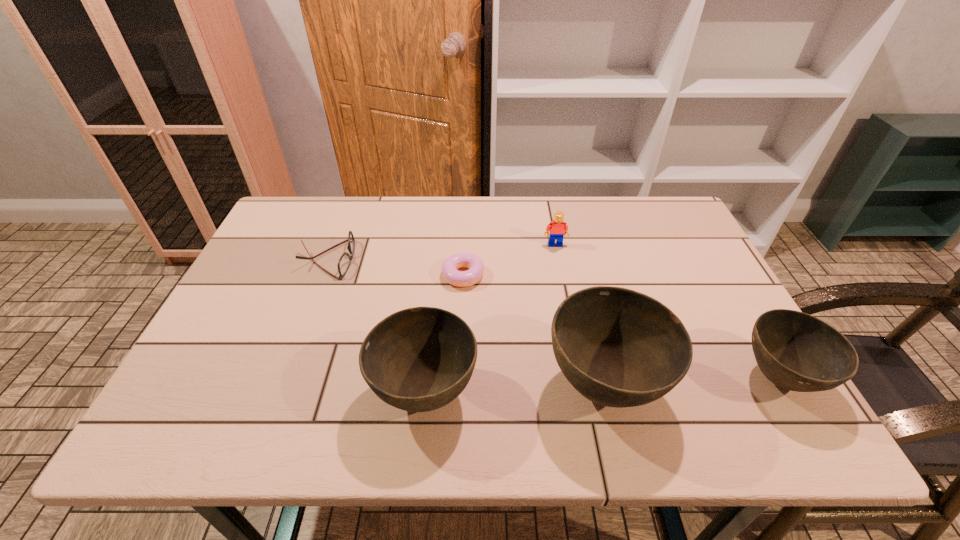
At what (x,y) coordinates should I click in order to perform the action: click on bowl that is the second nearest to the rightmost bowl. Please return your answer as a coordinate pair (x, y). The image size is (960, 540). Looking at the image, I should click on (419, 359).

Select which bowl is the second closest to the fifth shortest object. Please provide its 2D coordinates. Your answer should be formatted as a tuple, i.e. [(x, y)], where the tuple contains the x and y coordinates of a point satisfying the conditions above.

[(796, 351)]

You are a GUI agent. You are given a task and a screenshot of the screen. Output one action in this format:
    pyautogui.click(x=<x>, y=<y>)
    Task: Click on the free region that satisfies the following two spatial constraints: 1. on the front-facing side of the leftmost object; 2. on the left side of the leftmost bowl
    This screenshot has height=540, width=960.
    Given the screenshot: What is the action you would take?
    pyautogui.click(x=276, y=393)

I want to click on free space in the image that satisfies the following two spatial constraints: 1. on the front-facing side of the Lego; 2. on the front-facing side of the leftmost object, so pos(558,259).

Locate an element on the screen. The image size is (960, 540). vacant area that satisfies the following two spatial constraints: 1. on the front-facing side of the second bowl from right to left; 2. on the right side of the Lego is located at coordinates (583, 386).

Where is `free region that satisfies the following two spatial constraints: 1. on the front-facing side of the rightmost object; 2. on the right side of the Lego`? free region that satisfies the following two spatial constraints: 1. on the front-facing side of the rightmost object; 2. on the right side of the Lego is located at coordinates (582, 379).

I want to click on vacant point that satisfies the following two spatial constraints: 1. on the front-facing side of the Lego; 2. on the front-facing side of the spectacles, so click(x=558, y=259).

The width and height of the screenshot is (960, 540). Identify the location of vacant space that satisfies the following two spatial constraints: 1. on the back side of the leftmost bowl; 2. on the left side of the shortest bowl. (426, 379).

Identify the location of free space that satisfies the following two spatial constraints: 1. on the front-facing side of the Lego; 2. on the right side of the rightmost object. (582, 379).

Where is `vacant space that satisfies the following two spatial constraints: 1. on the front-facing side of the Lego; 2. on the left side of the rightmost object`? This screenshot has width=960, height=540. vacant space that satisfies the following two spatial constraints: 1. on the front-facing side of the Lego; 2. on the left side of the rightmost object is located at coordinates (582, 379).